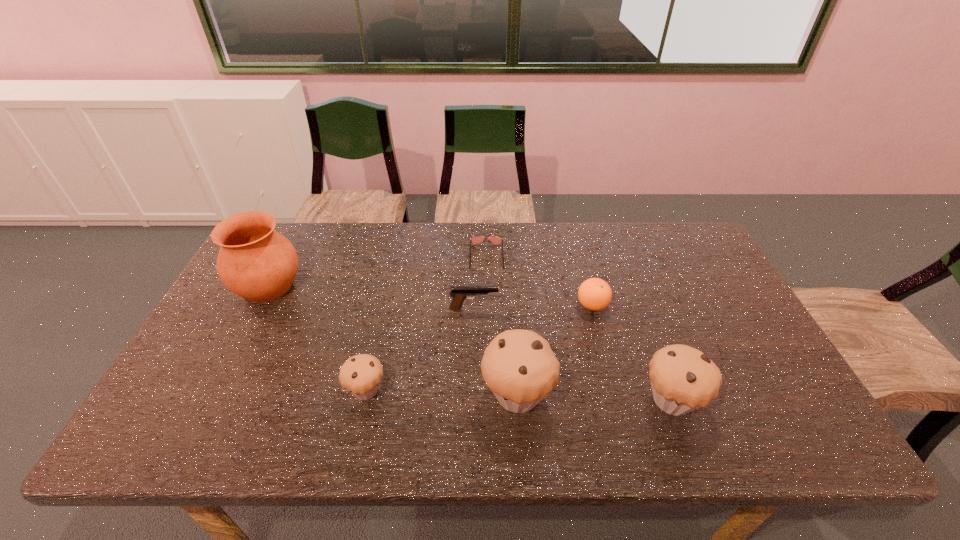
Where is `the sixth object from right to left`? The height and width of the screenshot is (540, 960). the sixth object from right to left is located at coordinates (361, 375).

Identify the location of the leftmost muffin. This screenshot has height=540, width=960. (361, 375).

Image resolution: width=960 pixels, height=540 pixels. I want to click on the second muffin from left to right, so click(x=519, y=367).

Locate an element on the screen. the third tallest object is located at coordinates (681, 376).

The image size is (960, 540). What are the coordinates of `the rightmost object` in the screenshot? It's located at (681, 376).

I want to click on sunglasses, so click(496, 240).

I want to click on pistol, so click(459, 293).

At what (x,y) coordinates should I click in order to perform the action: click on pottery. Please return your answer as a coordinate pair (x, y). Looking at the image, I should click on (256, 262).

You are a GUI agent. You are given a task and a screenshot of the screen. Output one action in this format:
    pyautogui.click(x=<x>, y=<y>)
    Task: Click on the tallest object
    The height and width of the screenshot is (540, 960).
    Given the screenshot: What is the action you would take?
    pyautogui.click(x=256, y=262)

Locate an element on the screen. This screenshot has height=540, width=960. orange is located at coordinates (594, 294).